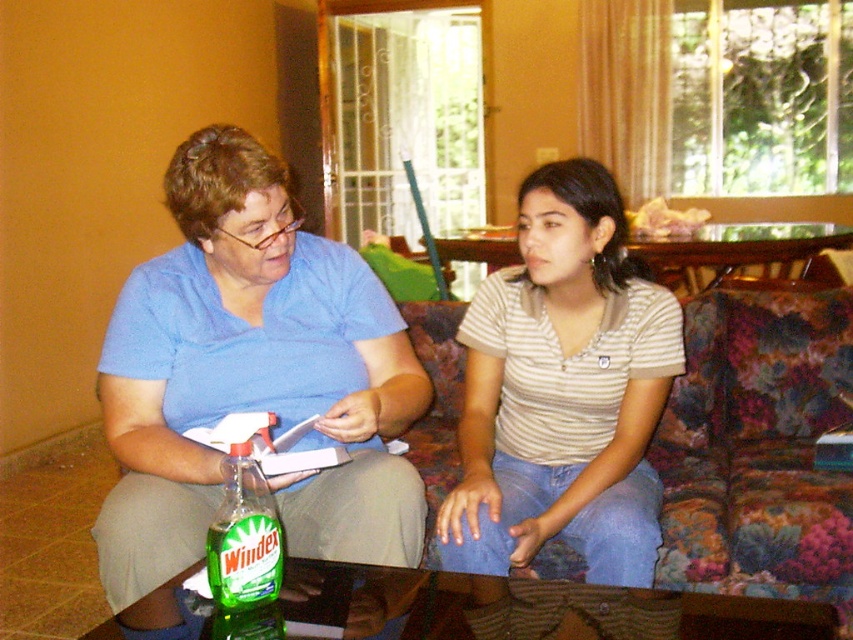
Question: From the image, what is the correct spatial relationship of striped cotton shirt at center in relation to floral fabric couch at center?

Choices:
 (A) left
 (B) right

Answer: (A)

Question: Which is nearer to the floral fabric couch at center?

Choices:
 (A) green glass windex at lower left
 (B) striped cotton shirt at center
 (C) green matte windex at left

Answer: (B)

Question: Does striped cotton shirt at center lie behind floral fabric couch at center?

Choices:
 (A) no
 (B) yes

Answer: (A)

Question: Is green matte windex at left positioned in front of green glass windex at lower left?

Choices:
 (A) yes
 (B) no

Answer: (B)

Question: Which object is closer to the camera taking this photo?

Choices:
 (A) green glass windex at lower left
 (B) floral fabric couch at center

Answer: (A)

Question: Among these points, which one is nearest to the camera?

Choices:
 (A) (256, 548)
 (B) (514, 438)
 (C) (317, 422)
 (D) (799, 364)

Answer: (A)